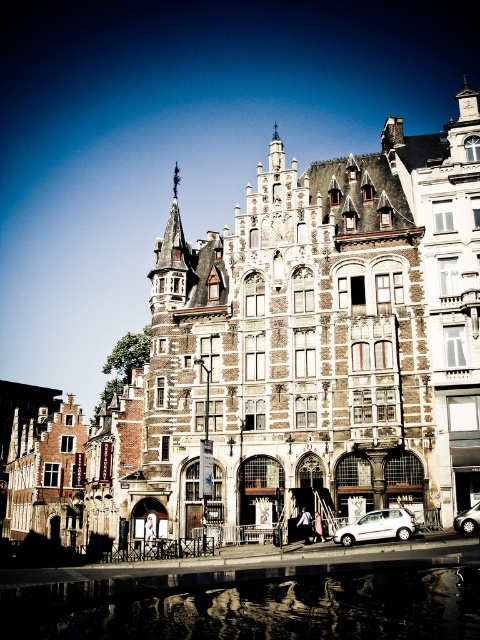
You are standing in front of the historic building and want to determine which of the two points, point (399, 525) or point (462, 516), is closer to you. Based on the building details, which point is nearer?

Point (399, 525) is closer to the viewer than point (462, 516).

You are standing in front of the historic building and want to take a photo. You notice two points marked on the building facade. The first point is at coordinates point (x=411, y=580) and the second is at point (x=466, y=516). Which point appears closer to your camera lens when taking the photo?

Point (x=411, y=580) is closer to the camera than point (x=466, y=516), so it will appear closer in the photo.